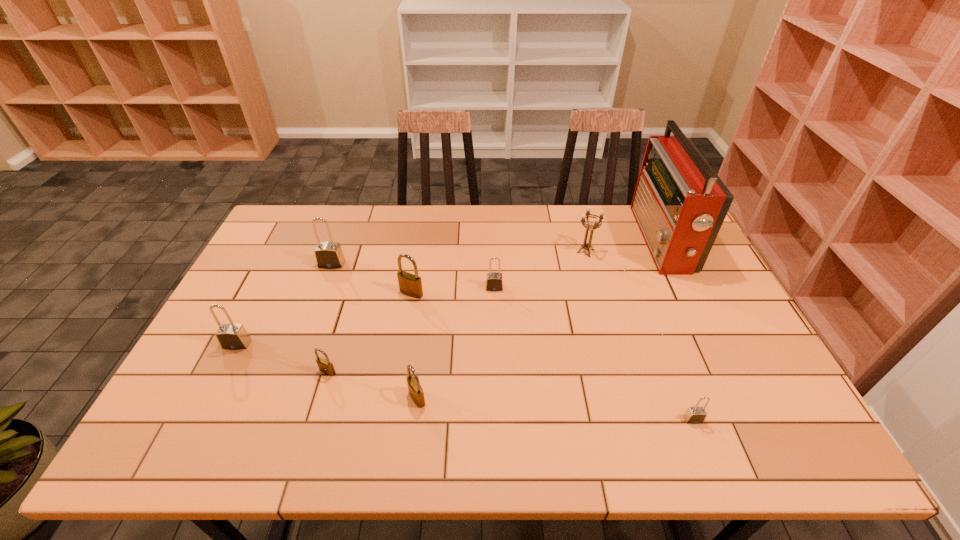
In order to click on object at the left edge in this screenshot , I will do `click(231, 336)`.

I want to click on object that is at the right edge, so click(x=679, y=203).

Identify the location of object located at the far right corner. The width and height of the screenshot is (960, 540). (679, 203).

Find the location of a particular element. free space at the far edge of the desktop is located at coordinates (367, 224).

Identify the location of vacant position at the near edge of the desktop. This screenshot has width=960, height=540. (259, 429).

In the image, there is a desktop. Where is `vacant region at the left edge`? vacant region at the left edge is located at coordinates (281, 289).

In the image, there is a desktop. Where is `vacant space at the right edge`? This screenshot has height=540, width=960. vacant space at the right edge is located at coordinates (737, 406).

Where is `free point at the far left corner`? This screenshot has width=960, height=540. free point at the far left corner is located at coordinates 278,238.

You are a GUI agent. You are given a task and a screenshot of the screen. Output one action in this format:
    pyautogui.click(x=<x>, y=<y>)
    Task: Click on the free spot between the biggest brass padlock and the sixth object from left to right
    This screenshot has height=540, width=960.
    Given the screenshot: What is the action you would take?
    pyautogui.click(x=453, y=291)

At what (x,y) coordinates should I click in order to perform the action: click on free space between the leftmost object and the sixth padlock from left to right. Please return your answer as a coordinate pair (x, y). This screenshot has width=960, height=540. Looking at the image, I should click on (366, 316).